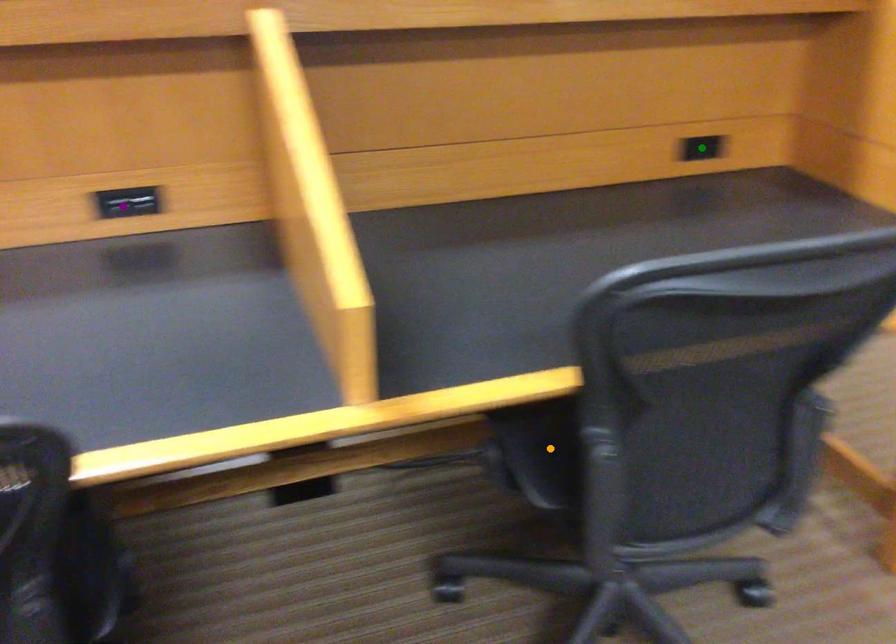
Order these from nearest to farthest:
orange point
green point
purple point

orange point
purple point
green point